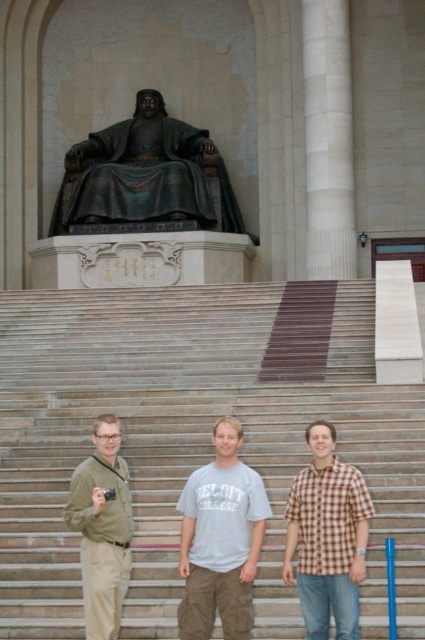
Question: Which object is positioned closest to the gray cotton t-shirt at center?

Choices:
 (A) brown checkered shirt at center
 (B) white marble column at center
 (C) bronze statue at upper center

Answer: (A)

Question: Can you confirm if gray cotton t-shirt at center is positioned to the left of khaki cotton pants at lower left?

Choices:
 (A) yes
 (B) no

Answer: (B)

Question: Does gray cotton t-shirt at center have a smaller size compared to white marble column at center?

Choices:
 (A) yes
 (B) no

Answer: (A)

Question: Can you confirm if gray cotton t-shirt at center is positioned above brown checkered shirt at center?

Choices:
 (A) no
 (B) yes

Answer: (A)

Question: Which object appears closest to the camera in this image?

Choices:
 (A) smooth stone stairs at center
 (B) bronze statue at upper center
 (C) khaki cotton pants at lower left
 (D) gray cotton t-shirt at center

Answer: (D)

Question: Based on their relative distances, which object is nearer to the smooth stone stairs at center?

Choices:
 (A) white marble column at center
 (B) gray cotton t-shirt at center
 (C) brown checkered shirt at center

Answer: (B)